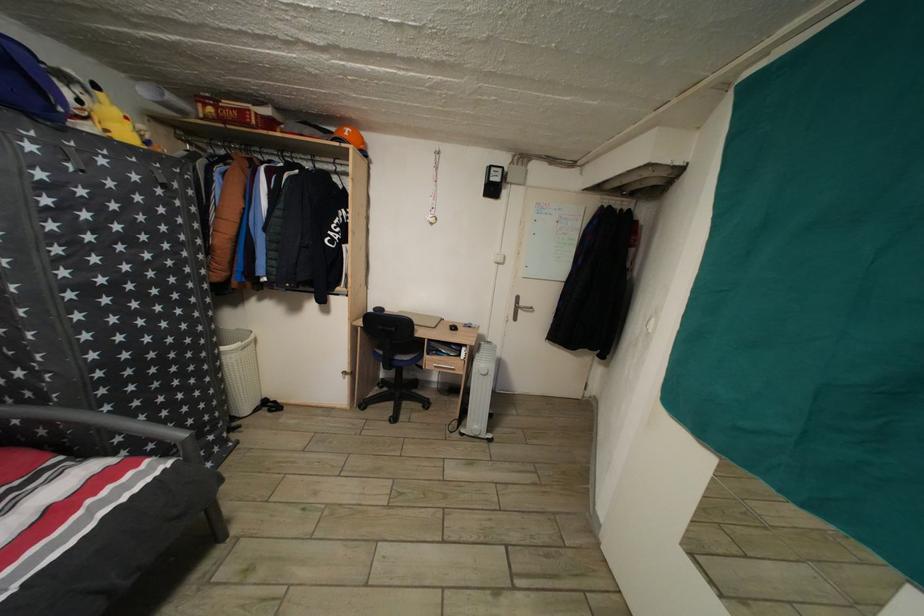
Where is `striped sofa surface`? striped sofa surface is located at coordinates (58, 504).